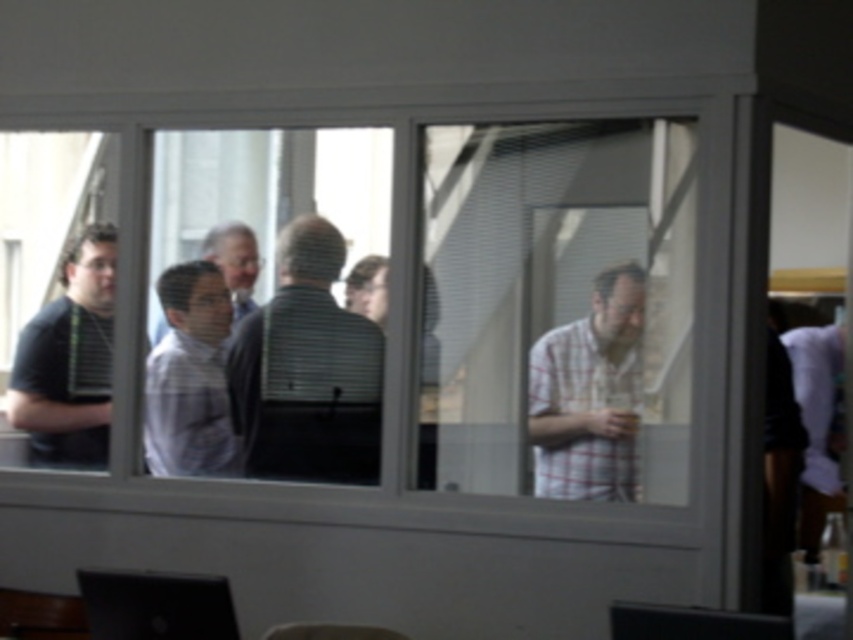
You are organizing a presentation and need to decide which device to use. The matte black laptop at lower left and the black glossy monitor at lower center are available. Which device has a larger screen width?

The matte black laptop at lower left has a larger screen width than the black glossy monitor at lower center.

You are standing outside the window and see two people inside through the glass. The black matte shirt at left and the light gray shirt at center. Which person is positioned lower in the image?

The black matte shirt at left is below the light gray shirt at center, so the person wearing the black matte shirt at left is positioned lower in the image.

You are a delivery person trying to deliver a package to the room shown through the transparent glass window at center. The package requires a signature, and you need to confirm if the people inside can see you clearly. Considering the window is 13.13 feet away from you, can they see you well enough to acknowledge your presence?

The transparent glass window at center is 13.13 feet from the camera, so the people inside the room can see you clearly at that distance to acknowledge your presence.